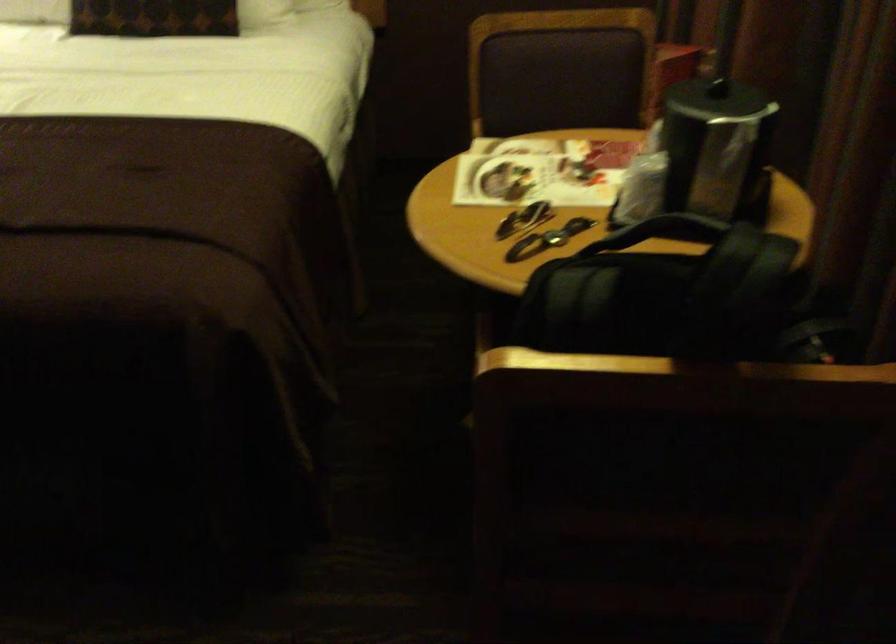
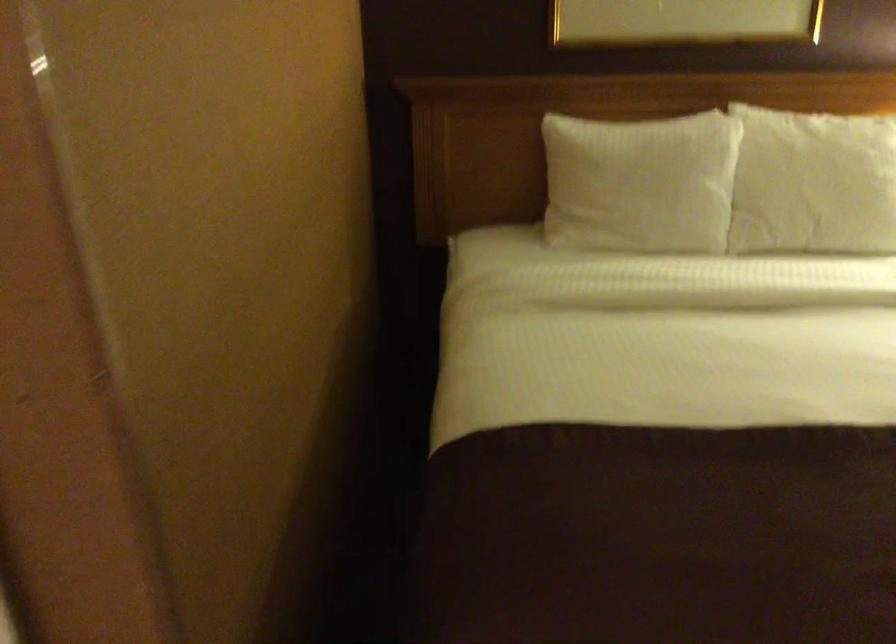
Question: Which direction would the cameraman need to move to produce the second image? Reply with the corresponding letter.

Choices:
 (A) Left
 (B) Right
 (C) Forward
 (D) Backward

Answer: (A)